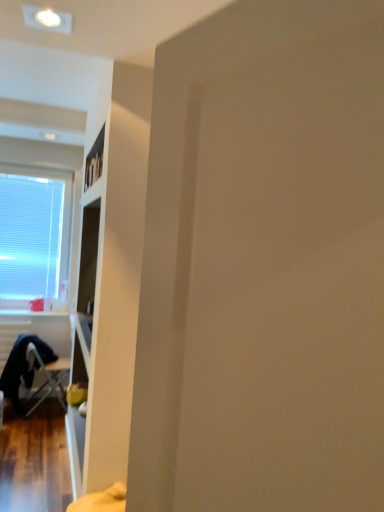
Image resolution: width=384 pixels, height=512 pixels. I want to click on white blinds at left, so click(x=34, y=234).

Image resolution: width=384 pixels, height=512 pixels. What do you see at coordinates (34, 234) in the screenshot?
I see `white blinds at left` at bounding box center [34, 234].

You are a GUI agent. You are given a task and a screenshot of the screen. Output one action in this format:
    pyautogui.click(x=<x>, y=<y>)
    Task: Click on the metallic silver folding chair at lower left
    The image size is (384, 512).
    Given the screenshot: What is the action you would take?
    coord(48,377)

Describe the element at coordinates (48, 377) in the screenshot. This screenshot has height=512, width=384. I see `metallic silver folding chair at lower left` at that location.

Locate an element on the screen. white blinds at left is located at coordinates (34, 234).

Consider the image. Does white blinds at left appear on the left side of metallic silver folding chair at lower left?

Indeed, white blinds at left is positioned on the left side of metallic silver folding chair at lower left.

Considering their positions, is white blinds at left located in front of or behind metallic silver folding chair at lower left?

white blinds at left is behind metallic silver folding chair at lower left.

Does point (26, 266) come in front of point (62, 369)?

Yes, point (26, 266) is closer to viewer.

From the image's perspective, is white blinds at left located above or below metallic silver folding chair at lower left?

white blinds at left is above metallic silver folding chair at lower left.

From a real-world perspective, which is physically below, white blinds at left or metallic silver folding chair at lower left?

In real-world perspective, metallic silver folding chair at lower left is lower.

Considering the relative sizes of white blinds at left and metallic silver folding chair at lower left in the image provided, is white blinds at left wider than metallic silver folding chair at lower left?

No, white blinds at left is not wider than metallic silver folding chair at lower left.

Considering the relative sizes of white blinds at left and metallic silver folding chair at lower left in the image provided, is white blinds at left taller than metallic silver folding chair at lower left?

Correct, white blinds at left is much taller as metallic silver folding chair at lower left.

Based on their sizes in the image, would you say white blinds at left is bigger or smaller than metallic silver folding chair at lower left?

In the image, white blinds at left appears to be smaller than metallic silver folding chair at lower left.

Is white blinds at left located outside metallic silver folding chair at lower left?

That's correct, white blinds at left is outside of metallic silver folding chair at lower left.

Is white blinds at left beside metallic silver folding chair at lower left?

There is a gap between white blinds at left and metallic silver folding chair at lower left.

Could you tell me if white blinds at left is facing metallic silver folding chair at lower left?

No, white blinds at left is not turned towards metallic silver folding chair at lower left.

How many degrees apart are the facing directions of white blinds at left and metallic silver folding chair at lower left?

92.8 degrees.

The width and height of the screenshot is (384, 512). What are the coordinates of `chair in front of the white blinds at left` in the screenshot? It's located at (48, 377).

Which is more to the left, metallic silver folding chair at lower left or white blinds at left?

white blinds at left is more to the left.

Which object is closer to the camera, metallic silver folding chair at lower left or white blinds at left?

metallic silver folding chair at lower left.

Which point is more forward, (52, 364) or (40, 180)?

The point (40, 180) is in front.

From the image's perspective, is metallic silver folding chair at lower left positioned above or below white blinds at left?

Clearly, from the image's perspective, metallic silver folding chair at lower left is below white blinds at left.

From a real-world perspective, which is physically above, metallic silver folding chair at lower left or white blinds at left?

In real-world perspective, white blinds at left is above.

Can you confirm if metallic silver folding chair at lower left is thinner than white blinds at left?

No, metallic silver folding chair at lower left is not thinner than white blinds at left.

From the picture: Which of these two, metallic silver folding chair at lower left or white blinds at left, stands shorter?

metallic silver folding chair at lower left.

Based on the photo, based on their sizes in the image, would you say metallic silver folding chair at lower left is bigger or smaller than white blinds at left?

Clearly, metallic silver folding chair at lower left is larger in size than white blinds at left.

Is metallic silver folding chair at lower left surrounding white blinds at left?

No, white blinds at left is not surrounded by metallic silver folding chair at lower left.

Are metallic silver folding chair at lower left and white blinds at left making contact?

No, metallic silver folding chair at lower left is not making contact with white blinds at left.

Is metallic silver folding chair at lower left facing towards white blinds at left?

No, metallic silver folding chair at lower left is not turned towards white blinds at left.

What's the angular difference between metallic silver folding chair at lower left and white blinds at left's facing directions?

The facing directions of metallic silver folding chair at lower left and white blinds at left are 92.8 degrees apart.

Locate an element on the screen. The image size is (384, 512). chair in front of the white blinds at left is located at coordinates (48, 377).

The width and height of the screenshot is (384, 512). I want to click on chair on the right of white blinds at left, so [48, 377].

Locate an element on the screen. chair that is below the white blinds at left (from the image's perspective) is located at coordinates (48, 377).